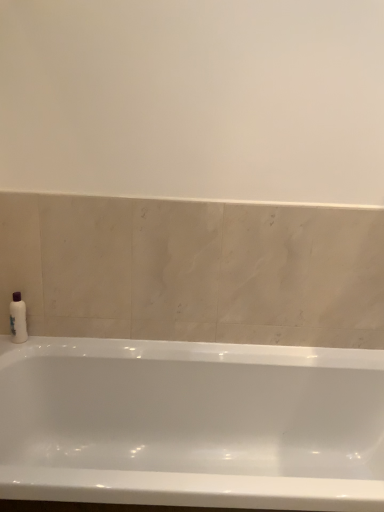
Question: In the image, is white plastic bottle at left on the left side or the right side of white glossy bathtub at lower center?

Choices:
 (A) left
 (B) right

Answer: (A)

Question: Considering the positions of white plastic bottle at left and white glossy bathtub at lower center in the image, is white plastic bottle at left taller or shorter than white glossy bathtub at lower center?

Choices:
 (A) tall
 (B) short

Answer: (B)

Question: Is white plastic bottle at left situated inside white glossy bathtub at lower center or outside?

Choices:
 (A) outside
 (B) inside

Answer: (A)

Question: Based on their sizes in the image, would you say white glossy bathtub at lower center is bigger or smaller than white plastic bottle at left?

Choices:
 (A) small
 (B) big

Answer: (B)

Question: From the image's perspective, is white glossy bathtub at lower center above or below white plastic bottle at left?

Choices:
 (A) above
 (B) below

Answer: (B)

Question: From a real-world perspective, is white glossy bathtub at lower center physically located above or below white plastic bottle at left?

Choices:
 (A) above
 (B) below

Answer: (B)

Question: Considering the relative positions of white glossy bathtub at lower center and white plastic bottle at left in the image provided, is white glossy bathtub at lower center to the left or to the right of white plastic bottle at left?

Choices:
 (A) left
 (B) right

Answer: (B)